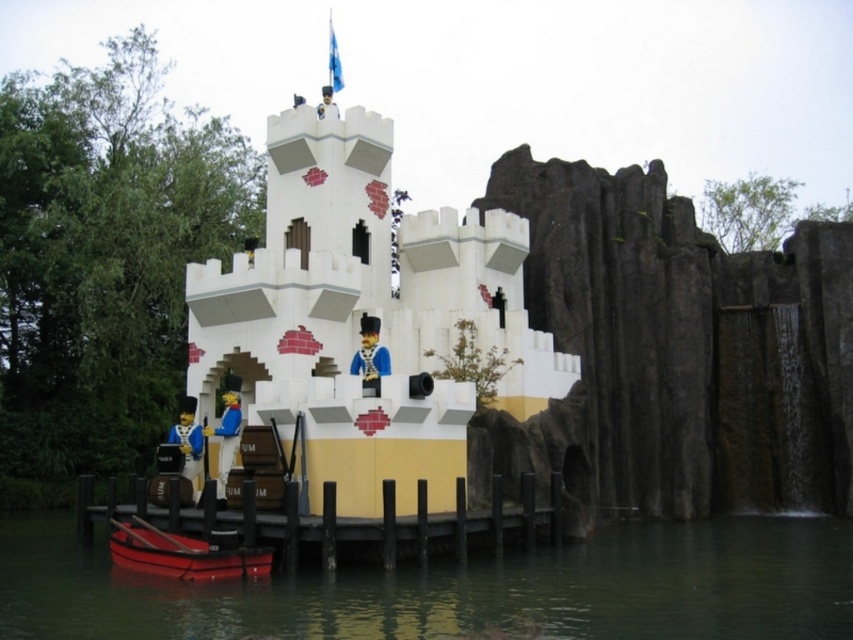
You are a visitor standing in front of the white plastic castle at center and the green matte water at lower center. Which object is closer to you?

The white plastic castle at center is closer to you since it is further to the viewer than the green matte water at lower center.

You are a visitor standing in front of the miniature LEGO castle. You notice the green matte water at lower center and the shiny red boat at lower left. Which object takes up more space in the image?

The green matte water at lower center takes up more space in the image because it is bigger than the shiny red boat at lower left.

You are a LEGO figure standing on the smooth wood dock at lower center and want to move to the shiny red boat at lower left. Can you walk directly from the dock to the boat without stepping into the water?

The smooth wood dock at lower center might be wider than shiny red boat at lower left, so it is uncertain if there is enough space to walk directly from the dock to the boat without stepping into the water.